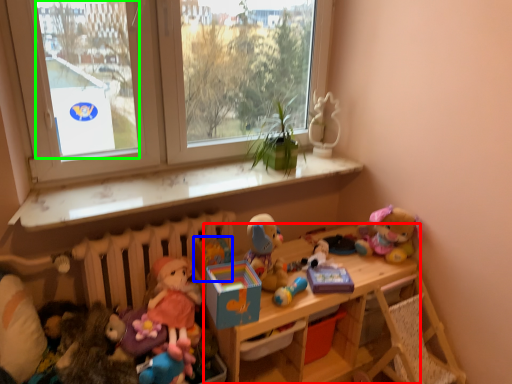
Question: Estimate the real-world distances between objects in this image. Which object is farther from shelf (highlighted by a red box), toy (highlighted by a blue box) or window screen (highlighted by a green box)?

Choices:
 (A) toy
 (B) window screen

Answer: (B)